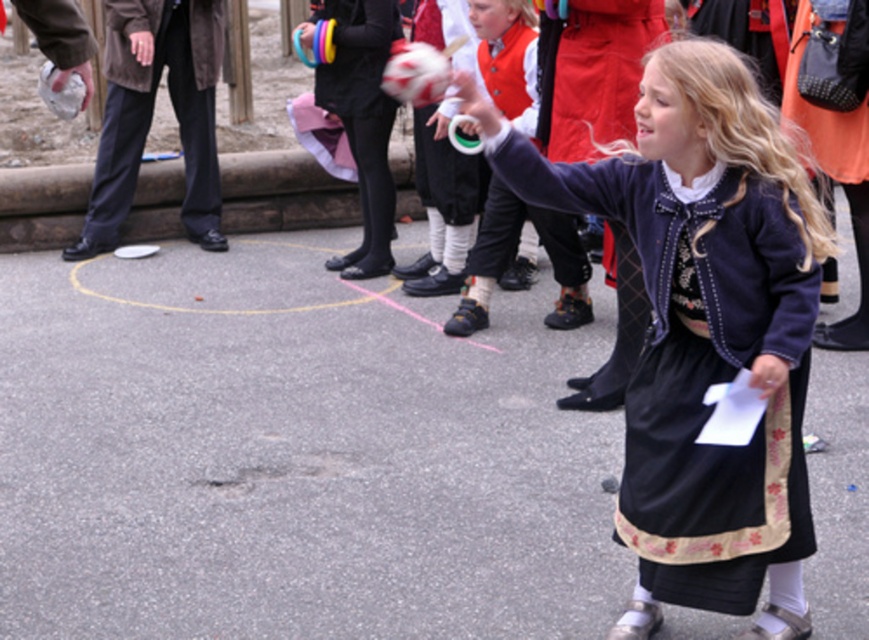
Question: Among these objects, which one is farthest from the camera?

Choices:
 (A) matte blue dress at center
 (B) matte black shoes at center

Answer: (B)

Question: Does matte blue dress at center have a larger size compared to matte black shoes at center?

Choices:
 (A) yes
 (B) no

Answer: (A)

Question: Which point is closer to the camera taking this photo?

Choices:
 (A) (523, 106)
 (B) (773, 403)

Answer: (B)

Question: Is matte blue dress at center further to camera compared to matte black shoes at center?

Choices:
 (A) no
 (B) yes

Answer: (A)

Question: Is matte blue dress at center positioned in front of matte black shoes at center?

Choices:
 (A) yes
 (B) no

Answer: (A)